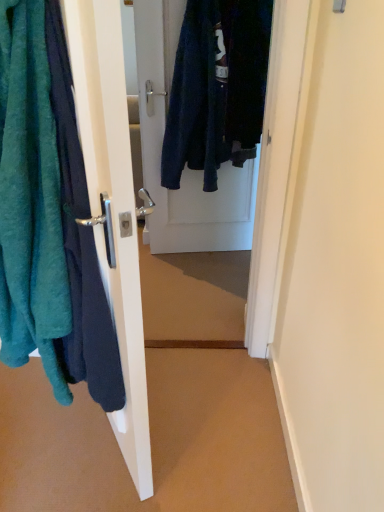
Locate an element on the screen. This screenshot has width=384, height=512. vacant area that is in front of matte white door handle at left, positioned as the second door in back-to-front order is located at coordinates (81, 475).